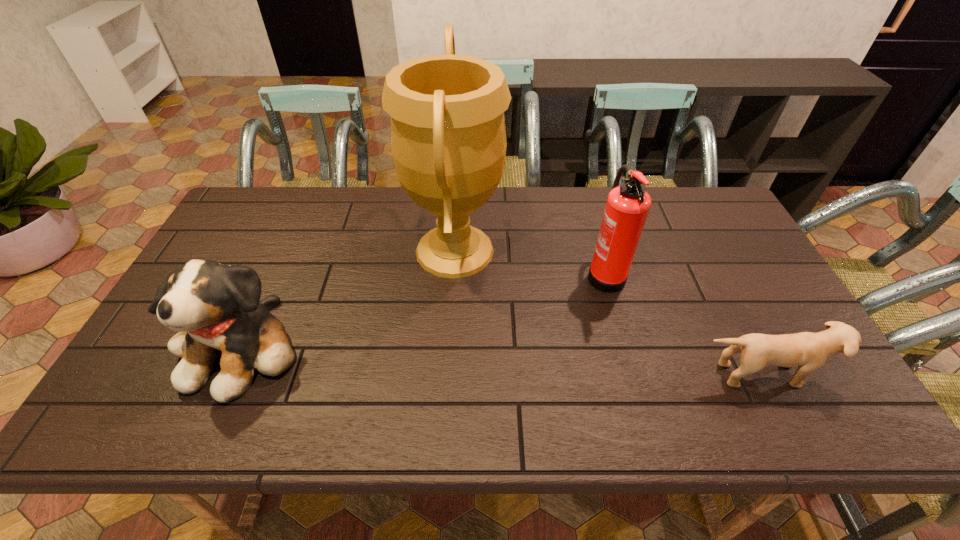
This screenshot has height=540, width=960. Find the location of `vacant space located 0.340m at the nozzle of the third shortest object`. vacant space located 0.340m at the nozzle of the third shortest object is located at coordinates (468, 273).

I want to click on free spot located at the nozzle of the third shortest object, so click(x=548, y=273).

Image resolution: width=960 pixels, height=540 pixels. I want to click on free space located on the left side of the rightmost object, so click(x=788, y=429).

Find the location of a particular element. The height and width of the screenshot is (540, 960). object that is positioned at the far edge is located at coordinates (448, 137).

What are the coordinates of `object located at the near edge` in the screenshot? It's located at (216, 309).

The width and height of the screenshot is (960, 540). I want to click on object located at the left edge, so click(x=216, y=309).

The image size is (960, 540). Find the location of `object that is positioned at the right edge`. object that is positioned at the right edge is located at coordinates (809, 351).

The height and width of the screenshot is (540, 960). Identify the location of object that is at the near left corner. (216, 309).

In order to click on vacant point at the far edge in this screenshot , I will do [x=589, y=212].

You are a GUI agent. You are given a task and a screenshot of the screen. Output one action in this format:
    pyautogui.click(x=<x>, y=<y>)
    Task: Click on the free space at the near edge of the desktop
    The image size is (960, 540).
    Given the screenshot: What is the action you would take?
    pyautogui.click(x=389, y=409)